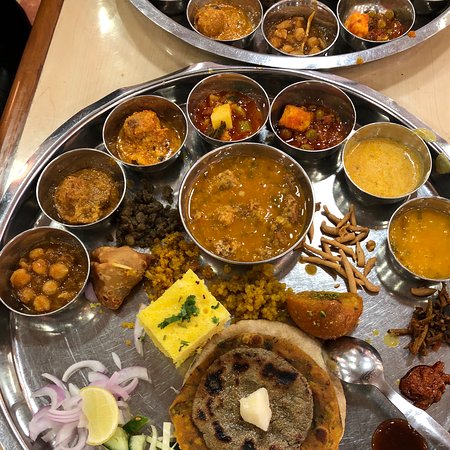
In order to click on table in this screenshot , I will do `click(424, 78)`.